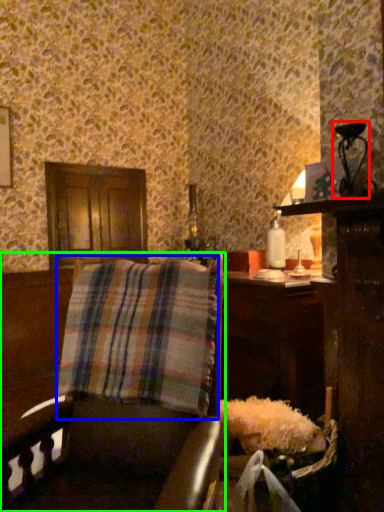
Question: Considering the real-world distances, which object is farthest from table lamp (highlighted by a red box)? plaid (highlighted by a blue box) or furniture (highlighted by a green box)?

Choices:
 (A) plaid
 (B) furniture

Answer: (B)